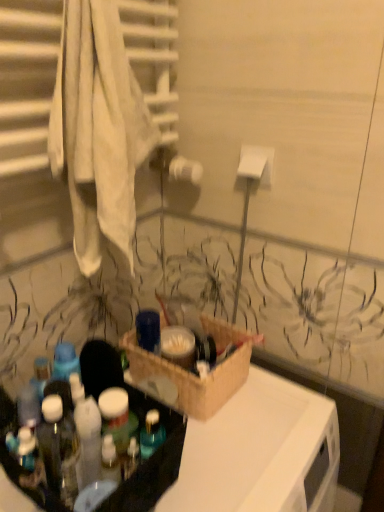
Question: Should I look upward or downward to see translucent plastic bottles at lower left?

Choices:
 (A) down
 (B) up

Answer: (A)

Question: Is translucent plastic bottles at lower left far away from woven basket at center?

Choices:
 (A) yes
 (B) no

Answer: (B)

Question: Is translucent plastic bottles at lower left at the right side of woven basket at center?

Choices:
 (A) yes
 (B) no

Answer: (B)

Question: From the image's perspective, is translucent plastic bottles at lower left below woven basket at center?

Choices:
 (A) yes
 (B) no

Answer: (A)

Question: Is translucent plastic bottles at lower left surrounding woven basket at center?

Choices:
 (A) yes
 (B) no

Answer: (B)

Question: Can we say translucent plastic bottles at lower left lies outside woven basket at center?

Choices:
 (A) no
 (B) yes

Answer: (B)

Question: Can you confirm if translucent plastic bottles at lower left is smaller than woven basket at center?

Choices:
 (A) yes
 (B) no

Answer: (A)

Question: Does woven basket at center have a smaller size compared to translucent plastic bottles at lower left?

Choices:
 (A) yes
 (B) no

Answer: (B)

Question: Are woven basket at center and translucent plastic bottles at lower left making contact?

Choices:
 (A) yes
 (B) no

Answer: (B)

Question: From a real-world perspective, is woven basket at center located higher than translucent plastic bottles at lower left?

Choices:
 (A) yes
 (B) no

Answer: (B)

Question: Is woven basket at center taller than translucent plastic bottles at lower left?

Choices:
 (A) no
 (B) yes

Answer: (A)

Question: From the image's perspective, is woven basket at center beneath translucent plastic bottles at lower left?

Choices:
 (A) yes
 (B) no

Answer: (B)

Question: Is woven basket at center positioned with its back to translucent plastic bottles at lower left?

Choices:
 (A) yes
 (B) no

Answer: (B)

Question: Looking at the image, does woven basket at center seem bigger or smaller compared to translucent plastic bottles at lower left?

Choices:
 (A) big
 (B) small

Answer: (A)